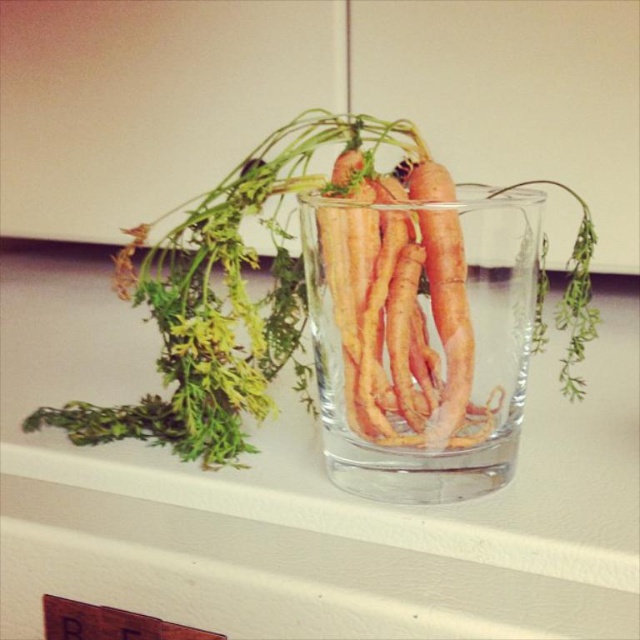
Does transparent glass carrots at center come in front of orange rough skin carrots at center?

Yes, it is.

Does point (301, 205) come in front of point (420, 216)?

No.

The image size is (640, 640). What do you see at coordinates (420, 340) in the screenshot? I see `transparent glass carrots at center` at bounding box center [420, 340].

The image size is (640, 640). What are the coordinates of `transparent glass carrots at center` in the screenshot? It's located at point(420,340).

Who is positioned more to the left, translucent glass vase at center or orange rough skin carrots at center?

From the viewer's perspective, translucent glass vase at center appears more on the left side.

Who is more distant from viewer, (372, 392) or (442, 257)?

Positioned behind is point (372, 392).

Locate an element on the screen. This screenshot has height=640, width=640. translucent glass vase at center is located at coordinates (298, 301).

Is point (625, 440) positioned behind point (460, 250)?

Yes.

Who is taller, clear glass at center or orange rough skin carrots at center?

With more height is clear glass at center.

Is point (16, 470) closer to viewer compared to point (451, 372)?

No, it is not.

This screenshot has height=640, width=640. What are the coordinates of `clear glass at center` in the screenshot? It's located at (301, 496).